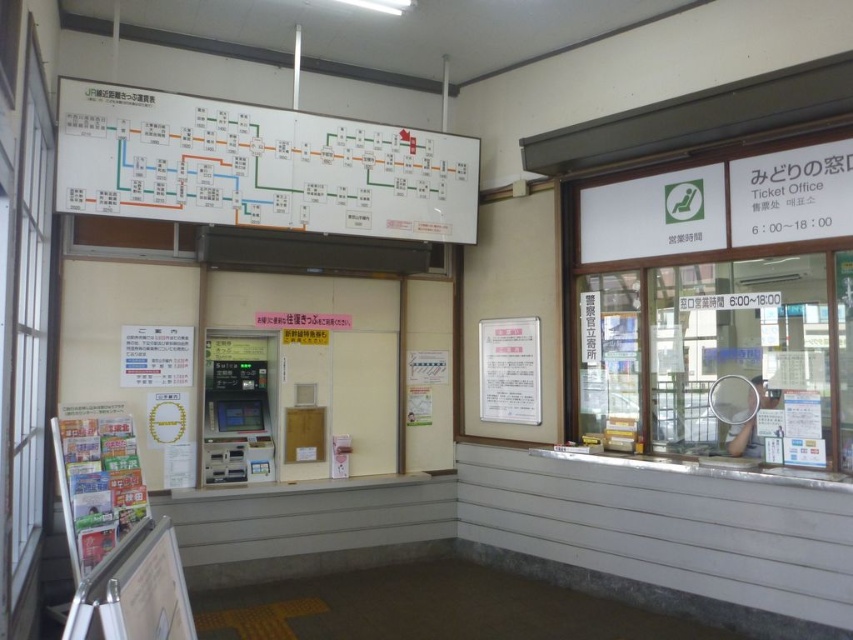
Does white glass window at right have a lesser width compared to white paper map at upper center?

Yes, white glass window at right is thinner than white paper map at upper center.

This screenshot has width=853, height=640. In order to click on white glass window at right in this screenshot , I will do `click(720, 301)`.

Who is lower down, white glass window at right or metallic gray atm at center?

Positioned lower is metallic gray atm at center.

Which is more to the left, white glass window at right or metallic gray atm at center?

metallic gray atm at center

At what (x,y) coordinates should I click in order to perform the action: click on white glass window at right. Please return your answer as a coordinate pair (x, y). The image size is (853, 640). Looking at the image, I should click on (720, 301).

Looking at this image, is white paper map at upper center to the right of metallic gray atm at center from the viewer's perspective?

Correct, you'll find white paper map at upper center to the right of metallic gray atm at center.

Between point (418, 240) and point (270, 381), which one is positioned in front?

Point (418, 240)

Identify the location of white paper map at upper center. The image size is (853, 640). (258, 166).